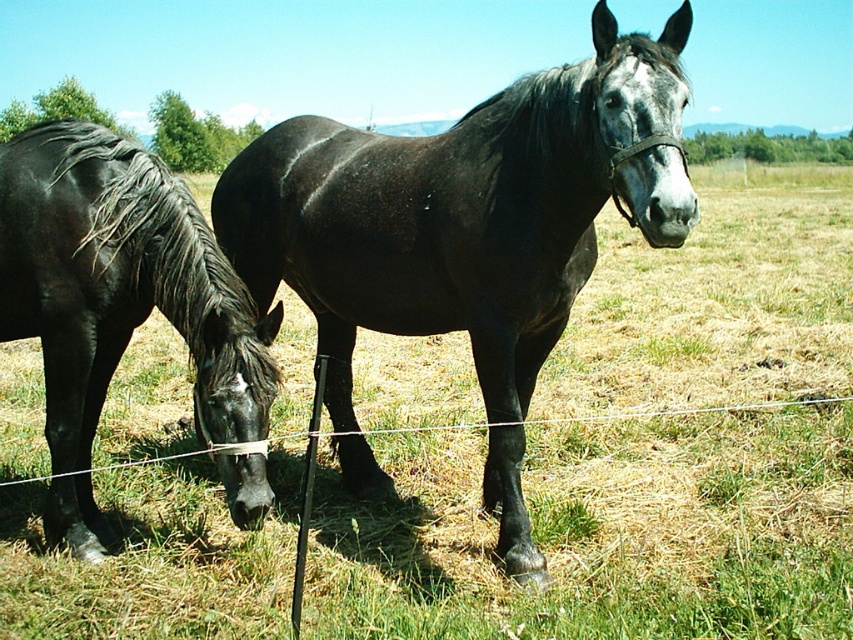
Question: Is shiny black horse at center to the right of black glossy horse at left from the viewer's perspective?

Choices:
 (A) no
 (B) yes

Answer: (B)

Question: Is shiny black horse at center behind black glossy horse at left?

Choices:
 (A) yes
 (B) no

Answer: (B)

Question: Which point appears closest to the camera in this image?

Choices:
 (A) (676, 67)
 (B) (45, 122)

Answer: (A)

Question: Can you confirm if shiny black horse at center is positioned to the left of black glossy horse at left?

Choices:
 (A) yes
 (B) no

Answer: (B)